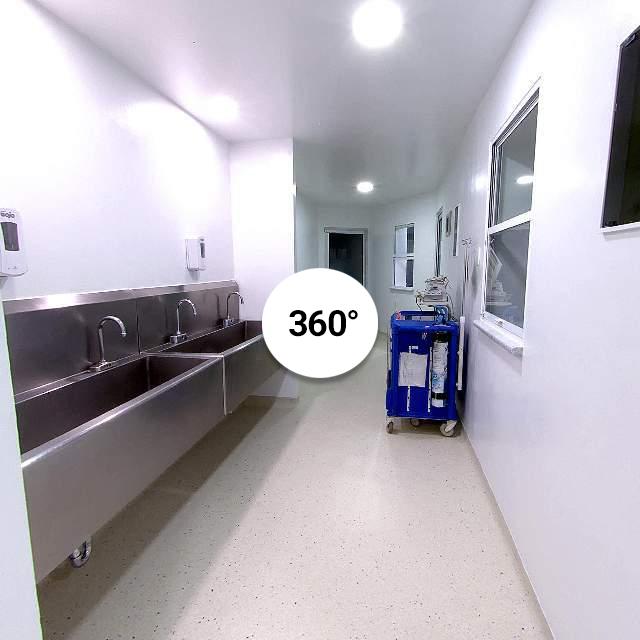
Locate an element on the screen. The image size is (640, 640). window is located at coordinates (404, 237), (438, 243), (516, 205).